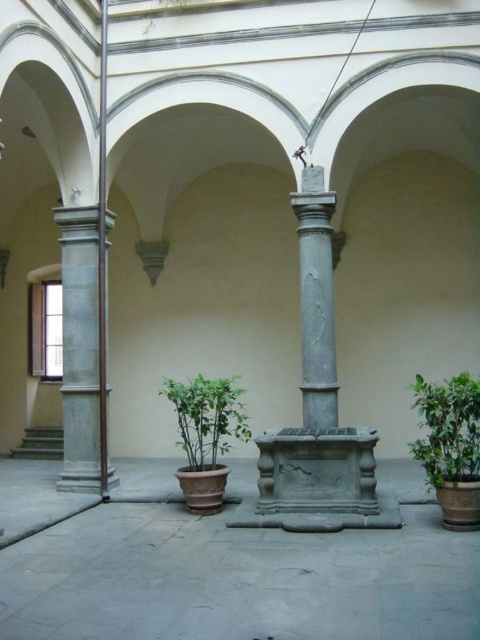
You are standing in the courtyard and want to take a photo of the gray stone column at left. If your camera has a maximum focus range of 10 meters, will it be able to capture the column clearly?

The gray stone column at left and camera are 9.08 meters apart from each other, so yes, the camera can focus on the column since the distance is within the 10 meter range.

You are standing in the courtyard and want to know which gray stone column is taller. You see the gray stone column at left and the gray stone column at center. Which one is taller?

The gray stone column at left is much taller than the gray stone column at center.

You are standing in the courtyard and want to take a photo of both the gray stone column at left and the gray stone column at center. However, you notice that one of them is partially hidden. Which column is blocking the view of the other?

The gray stone column at center is behind the gray stone column at left, so the gray stone column at left is blocking the view of the gray stone column at center.